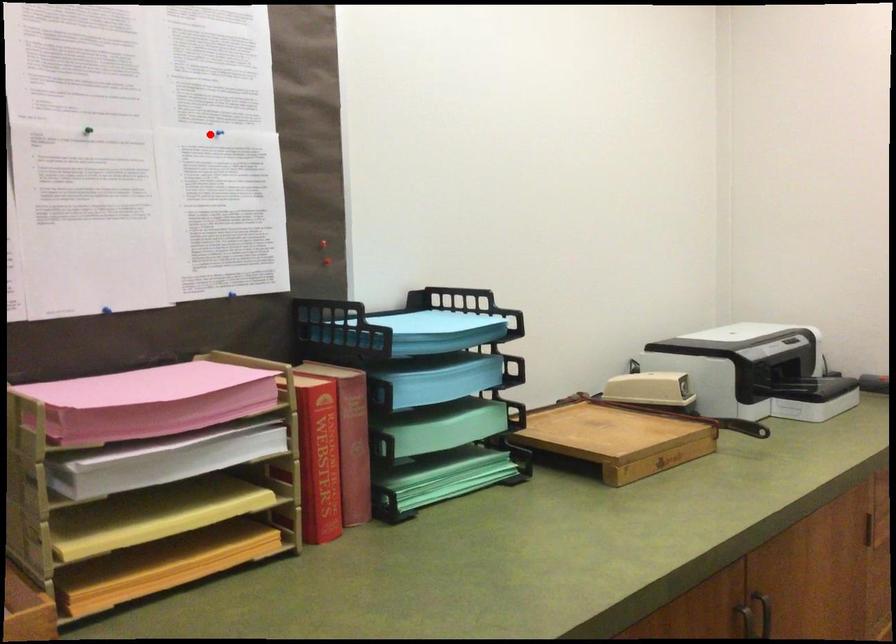
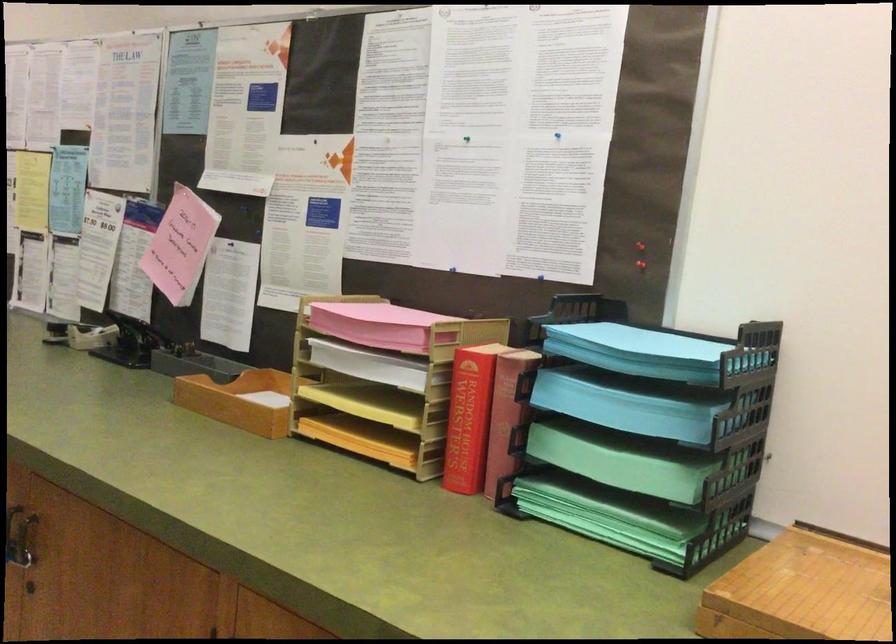
Where in the second image is the point corresponding to the highlighted location from the first image?

(556, 135)